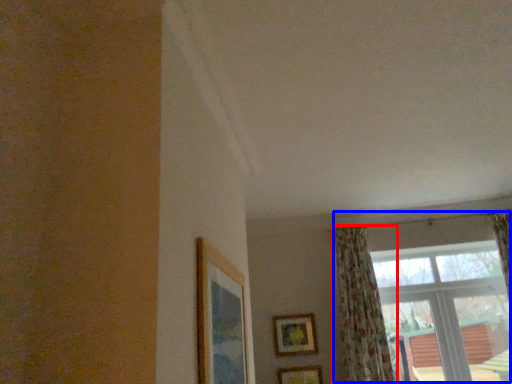
Question: Which object appears closest to the camera in this image, curtain (highlighted by a red box) or window (highlighted by a blue box)?

Choices:
 (A) curtain
 (B) window

Answer: (A)